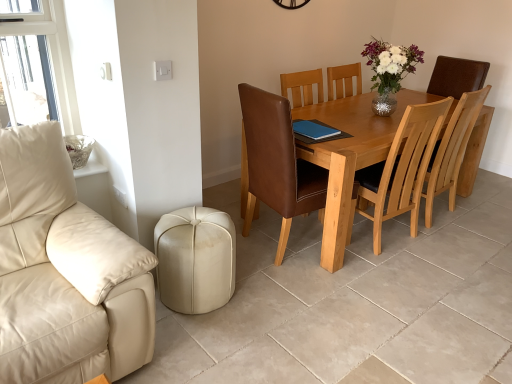
This screenshot has height=384, width=512. I want to click on free space in front of light brown wood chair at center, which ranks as the second chair in left-to-right order, so click(437, 243).